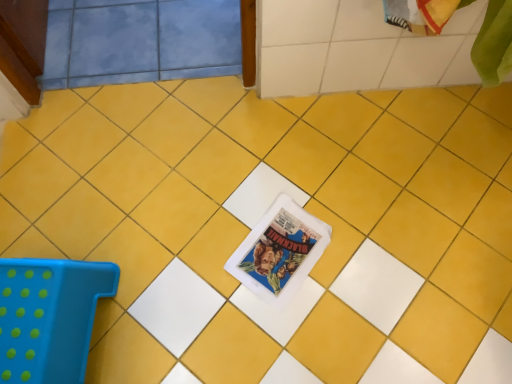
Locate an element on the screen. The height and width of the screenshot is (384, 512). vacant point to the right of blue plastic stool at lower left is located at coordinates (169, 307).